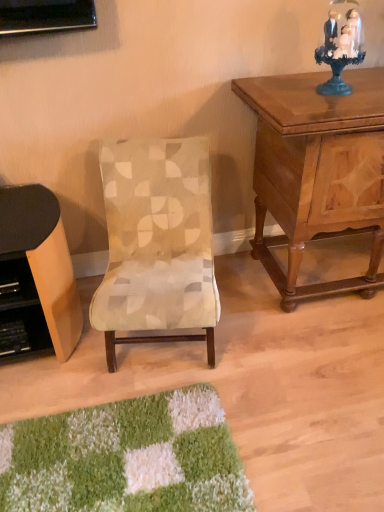
Question: Does light brown wood desk at left have a smaller size compared to blue glass figurine at upper right?

Choices:
 (A) yes
 (B) no

Answer: (B)

Question: Are light brown wood desk at left and blue glass figurine at upper right making contact?

Choices:
 (A) no
 (B) yes

Answer: (A)

Question: From a real-world perspective, is light brown wood desk at left over blue glass figurine at upper right?

Choices:
 (A) no
 (B) yes

Answer: (A)

Question: Is light brown wood desk at left further to camera compared to blue glass figurine at upper right?

Choices:
 (A) no
 (B) yes

Answer: (A)

Question: Considering the relative sizes of light brown wood desk at left and blue glass figurine at upper right in the image provided, is light brown wood desk at left wider than blue glass figurine at upper right?

Choices:
 (A) yes
 (B) no

Answer: (A)

Question: Is light brown wood desk at left facing towards blue glass figurine at upper right?

Choices:
 (A) no
 (B) yes

Answer: (A)

Question: From the image's perspective, is blue glass figurine at upper right over light brown wood desk at left?

Choices:
 (A) yes
 (B) no

Answer: (A)

Question: Can you confirm if blue glass figurine at upper right is bigger than light brown wood desk at left?

Choices:
 (A) yes
 (B) no

Answer: (B)

Question: From a real-world perspective, is blue glass figurine at upper right positioned under light brown wood desk at left based on gravity?

Choices:
 (A) no
 (B) yes

Answer: (A)

Question: Is light brown wood desk at left inside blue glass figurine at upper right?

Choices:
 (A) yes
 (B) no

Answer: (B)

Question: Could you tell me if blue glass figurine at upper right is facing light brown wood desk at left?

Choices:
 (A) no
 (B) yes

Answer: (A)

Question: Is blue glass figurine at upper right shorter than light brown wood desk at left?

Choices:
 (A) yes
 (B) no

Answer: (A)

Question: Can you confirm if beige fabric chair at center is taller than blue glass figurine at upper right?

Choices:
 (A) no
 (B) yes

Answer: (B)